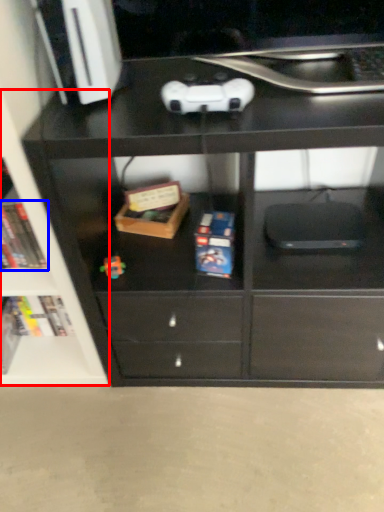
Question: Among these objects, which one is farthest to the camera, shelf (highlighted by a red box) or book (highlighted by a blue box)?

Choices:
 (A) shelf
 (B) book

Answer: (B)